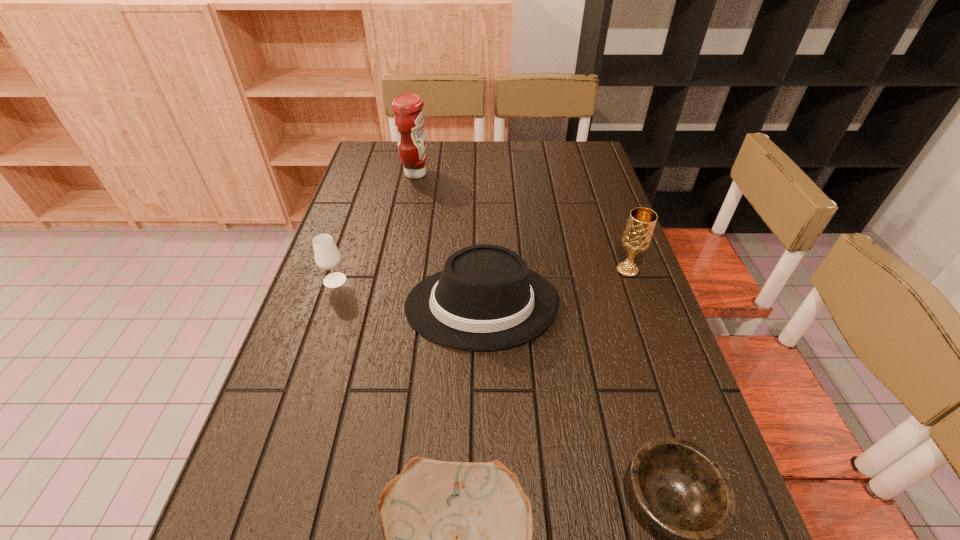
Locate an element on the screen. The width and height of the screenshot is (960, 540). the tallest object is located at coordinates (409, 117).

Identify the location of condiment. Image resolution: width=960 pixels, height=540 pixels. (409, 117).

Identify the location of chalice. (639, 229).

Where is `fedora`? fedora is located at coordinates (486, 298).

Find the location of `the leftmost object`. the leftmost object is located at coordinates (327, 256).

The height and width of the screenshot is (540, 960). I want to click on free point located on the back of the tallest object, so click(421, 146).

The height and width of the screenshot is (540, 960). I want to click on free space located 0.090m on the back of the fifth shortest object, so click(x=616, y=240).

The height and width of the screenshot is (540, 960). I want to click on vacant space located 0.130m on the front-facing side of the fedora, so click(351, 305).

I want to click on vacant space located 0.220m on the front-facing side of the fedora, so click(x=315, y=305).

The width and height of the screenshot is (960, 540). Find the location of `vacant space located 0.120m on the front-facing side of the fedora`. vacant space located 0.120m on the front-facing side of the fedora is located at coordinates (356, 305).